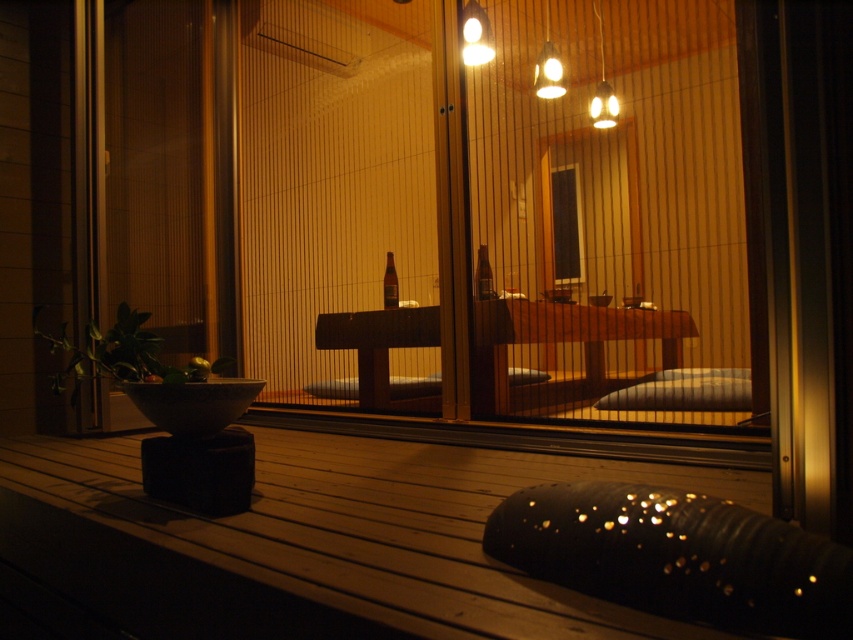
Question: Does matte glass bottle at center come in front of brown glass bottle at center?

Choices:
 (A) yes
 (B) no

Answer: (A)

Question: From the image, what is the correct spatial relationship of matte glass bottle at center in relation to brown glass bottle at center?

Choices:
 (A) below
 (B) above

Answer: (B)

Question: Among these objects, which one is nearest to the camera?

Choices:
 (A) brown glass bottle at center
 (B) matte glass bottle at center

Answer: (B)

Question: In this image, where is matte glass bottle at center located relative to brown glass bottle at center?

Choices:
 (A) above
 (B) below

Answer: (A)

Question: Which point appears closest to the camera in this image?

Choices:
 (A) (489, 284)
 (B) (389, 280)

Answer: (A)